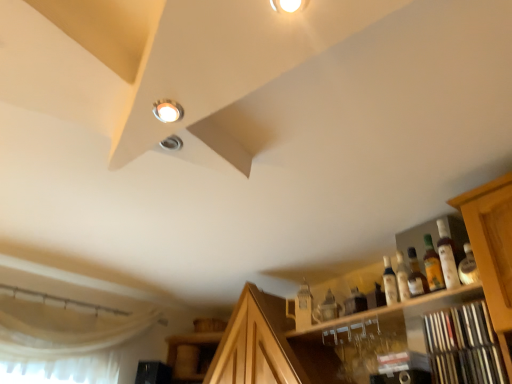
This screenshot has width=512, height=384. Identify the location of wooden shelf at lower right. (464, 346).

Describe the element at coordinates (447, 257) in the screenshot. I see `translucent glass bottle at right, marked as the 3th bottle in a left-to-right arrangement` at that location.

Consider the image. What is the approximate width of translucent glass bottle at right, marked as the 3th bottle in a left-to-right arrangement?

7.25 centimeters.

In order to face translucent amber bottle at upper right, marked as the 2th bottle in a left-to-right arrangement, should I rotate leftwards or rightwards?

A 22.139 degree turn to the right will do.

Image resolution: width=512 pixels, height=384 pixels. In order to click on translucent amber bottle at upper right, which is the second bottle in right-to-left order in this screenshot , I will do `click(432, 266)`.

What do you see at coordinates (168, 111) in the screenshot? I see `matte white droplight at upper left` at bounding box center [168, 111].

Where is `wooden shelf at lower right`? The image size is (512, 384). wooden shelf at lower right is located at coordinates (464, 346).

Can you see translucent glass bottle at right, the first bottle when ordered from right to left, touching translucent amber bottle at upper right, which is the second bottle in right-to-left order?

Yes, the surface of translucent glass bottle at right, the first bottle when ordered from right to left, is in contact with translucent amber bottle at upper right, which is the second bottle in right-to-left order.

From the picture: Is translucent glass bottle at right, marked as the 3th bottle in a left-to-right arrangement, aimed at translucent amber bottle at upper right, marked as the 2th bottle in a left-to-right arrangement?

No, translucent glass bottle at right, marked as the 3th bottle in a left-to-right arrangement, is not facing towards translucent amber bottle at upper right, marked as the 2th bottle in a left-to-right arrangement.

Is point (454, 249) positioned in front of point (436, 290)?

No, (454, 249) is behind (436, 290).

From the image's perspective, is wooden cabinet at upper right below translucent glass bottle at right, the first bottle when ordered from right to left?

Yes.

From a real-world perspective, who is located higher, wooden cabinet at upper right or translucent glass bottle at right, marked as the 3th bottle in a left-to-right arrangement?

translucent glass bottle at right, marked as the 3th bottle in a left-to-right arrangement, is physically above.

Which of these two, wooden cabinet at upper right or translucent glass bottle at right, the first bottle when ordered from right to left, is thinner?

translucent glass bottle at right, the first bottle when ordered from right to left, is thinner.

Is wooden cabinet at upper right not within translucent glass bottle at right, the first bottle when ordered from right to left?

That's correct, wooden cabinet at upper right is outside of translucent glass bottle at right, the first bottle when ordered from right to left.

Does point (391, 301) come in front of point (446, 379)?

No, (391, 301) is behind (446, 379).

Considering the relative positions of matte glass bottle at right, arranged as the 3th bottle when viewed from the right, and wooden shelf at lower right in the image provided, is matte glass bottle at right, arranged as the 3th bottle when viewed from the right, behind wooden shelf at lower right?

Yes, it is behind wooden shelf at lower right.

Which of these two, matte glass bottle at right, arranged as the 3th bottle when viewed from the right, or wooden shelf at lower right, is wider?

Wider between the two is wooden shelf at lower right.

Considering the points (440, 232) and (392, 282), which point is behind, point (440, 232) or point (392, 282)?

The point (440, 232) is farther from the camera.

From the image's perspective, which one is positioned higher, translucent glass bottle at right, marked as the 3th bottle in a left-to-right arrangement, or matte glass bottle at right, the 1th bottle positioned from the left?

translucent glass bottle at right, marked as the 3th bottle in a left-to-right arrangement, appears higher in the image.

Is translucent glass bottle at right, the first bottle when ordered from right to left, thinner than matte glass bottle at right, arranged as the 3th bottle when viewed from the right?

No.

Is translucent glass bottle at right, marked as the 3th bottle in a left-to-right arrangement, positioned with its back to matte glass bottle at right, arranged as the 3th bottle when viewed from the right?

No, translucent glass bottle at right, marked as the 3th bottle in a left-to-right arrangement, is not facing away from matte glass bottle at right, arranged as the 3th bottle when viewed from the right.

Which is closer to the camera, (x=426, y=247) or (x=442, y=331)?

The point (x=442, y=331) is closer to the camera.

Between translucent amber bottle at upper right, which is the second bottle in right-to-left order, and wooden shelf at lower right, which one has more height?

With more height is wooden shelf at lower right.

Is translucent amber bottle at upper right, which is the second bottle in right-to-left order, oriented away from wooden shelf at lower right?

translucent amber bottle at upper right, which is the second bottle in right-to-left order, is not turned away from wooden shelf at lower right.

From the image's perspective, is translucent amber bottle at upper right, marked as the 2th bottle in a left-to-right arrangement, above wooden shelf at lower right?

Yes, from the image's perspective, translucent amber bottle at upper right, marked as the 2th bottle in a left-to-right arrangement, is over wooden shelf at lower right.

Is translucent amber bottle at upper right, marked as the 2th bottle in a left-to-right arrangement, looking in the opposite direction of translucent glass bottle at right, the first bottle when ordered from right to left?

No, translucent amber bottle at upper right, marked as the 2th bottle in a left-to-right arrangement, is not facing the opposite direction of translucent glass bottle at right, the first bottle when ordered from right to left.

Which of these two, translucent amber bottle at upper right, which is the second bottle in right-to-left order, or translucent glass bottle at right, the first bottle when ordered from right to left, is bigger?

Bigger between the two is translucent glass bottle at right, the first bottle when ordered from right to left.

Is translucent amber bottle at upper right, marked as the 2th bottle in a left-to-right arrangement, positioned behind translucent glass bottle at right, marked as the 3th bottle in a left-to-right arrangement?

Yes, it is.

Would you say translucent amber bottle at upper right, marked as the 2th bottle in a left-to-right arrangement, is to the left or to the right of translucent glass bottle at right, marked as the 3th bottle in a left-to-right arrangement, in the picture?

In the image, translucent amber bottle at upper right, marked as the 2th bottle in a left-to-right arrangement, appears on the left side of translucent glass bottle at right, marked as the 3th bottle in a left-to-right arrangement.

Is wooden shelf at lower right oriented away from wooden cabinet at upper right?

That's right, wooden shelf at lower right is facing away from wooden cabinet at upper right.

From a real-world perspective, is wooden shelf at lower right physically located above or below wooden cabinet at upper right?

wooden shelf at lower right is situated lower than wooden cabinet at upper right in the real world.

Which of these two, wooden shelf at lower right or wooden cabinet at upper right, is bigger?

wooden cabinet at upper right.

The image size is (512, 384). I want to click on bottle above the translucent amber bottle at upper right, which is the second bottle in right-to-left order (from a real-world perspective), so click(x=447, y=257).

At what (x,y) coordinates should I click in order to perform the action: click on the 1st bottle behind the wooden cabinet at upper right, starting your count from the anchor. Please return your answer as a coordinate pair (x, y). This screenshot has width=512, height=384. Looking at the image, I should click on (447, 257).

From the image, which object appears to be farther from wooden shelf at lower right, matte glass bottle at right, arranged as the 3th bottle when viewed from the right, or matte white droplight at upper left?

matte white droplight at upper left lies further to wooden shelf at lower right than the other object.

In the scene shown: Estimate the real-world distances between objects in this image. Which object is closer to matte white droplight at upper left, translucent glass bottle at right, marked as the 3th bottle in a left-to-right arrangement, or wooden shelf at lower right?

Among the two, wooden shelf at lower right is located nearer to matte white droplight at upper left.

Looking at the image, which one is located closer to matte white droplight at upper left, translucent amber bottle at upper right, which is the second bottle in right-to-left order, or wooden shelf at lower right?

wooden shelf at lower right lies closer to matte white droplight at upper left than the other object.

When comparing their distances from matte white droplight at upper left, does wooden shelf at lower right or matte glass bottle at right, the 1th bottle positioned from the left, seem closer?

wooden shelf at lower right is closer to matte white droplight at upper left.

Looking at the image, which one is located further to wooden shelf at lower right, matte white droplight at upper left or translucent glass bottle at right, the first bottle when ordered from right to left?

Among the two, matte white droplight at upper left is located further to wooden shelf at lower right.

Looking at the image, which one is located further to wooden shelf at lower right, wooden cabinet at upper right or matte glass bottle at right, arranged as the 3th bottle when viewed from the right?

A: matte glass bottle at right, arranged as the 3th bottle when viewed from the right, is further to wooden shelf at lower right.

Based on their spatial positions, is matte white droplight at upper left or translucent amber bottle at upper right, which is the second bottle in right-to-left order, closer to translucent glass bottle at right, the first bottle when ordered from right to left?

Based on the image, translucent amber bottle at upper right, which is the second bottle in right-to-left order, appears to be nearer to translucent glass bottle at right, the first bottle when ordered from right to left.

From the image, which object appears to be nearer to wooden shelf at lower right, translucent amber bottle at upper right, marked as the 2th bottle in a left-to-right arrangement, or translucent glass bottle at right, marked as the 3th bottle in a left-to-right arrangement?

translucent glass bottle at right, marked as the 3th bottle in a left-to-right arrangement, lies closer to wooden shelf at lower right than the other object.

This screenshot has height=384, width=512. Find the location of `shelf located between wooden cabinet at upper right and translucent glass bottle at right, marked as the 3th bottle in a left-to-right arrangement, in the depth direction`. shelf located between wooden cabinet at upper right and translucent glass bottle at right, marked as the 3th bottle in a left-to-right arrangement, in the depth direction is located at coordinates (464, 346).

Where is `cabinetry between matte white droplight at upper left and translucent glass bottle at right, marked as the 3th bottle in a left-to-right arrangement, from left to right`? The width and height of the screenshot is (512, 384). cabinetry between matte white droplight at upper left and translucent glass bottle at right, marked as the 3th bottle in a left-to-right arrangement, from left to right is located at coordinates (432, 312).

Find the location of a particular element. bottle between translucent glass bottle at right, marked as the 3th bottle in a left-to-right arrangement, and matte glass bottle at right, the 1th bottle positioned from the left, in the front-back direction is located at coordinates [x=432, y=266].

Where is `bottle positioned between wooden cabinet at upper right and translucent amber bottle at upper right, marked as the 2th bottle in a left-to-right arrangement, from near to far`? This screenshot has width=512, height=384. bottle positioned between wooden cabinet at upper right and translucent amber bottle at upper right, marked as the 2th bottle in a left-to-right arrangement, from near to far is located at coordinates (447, 257).